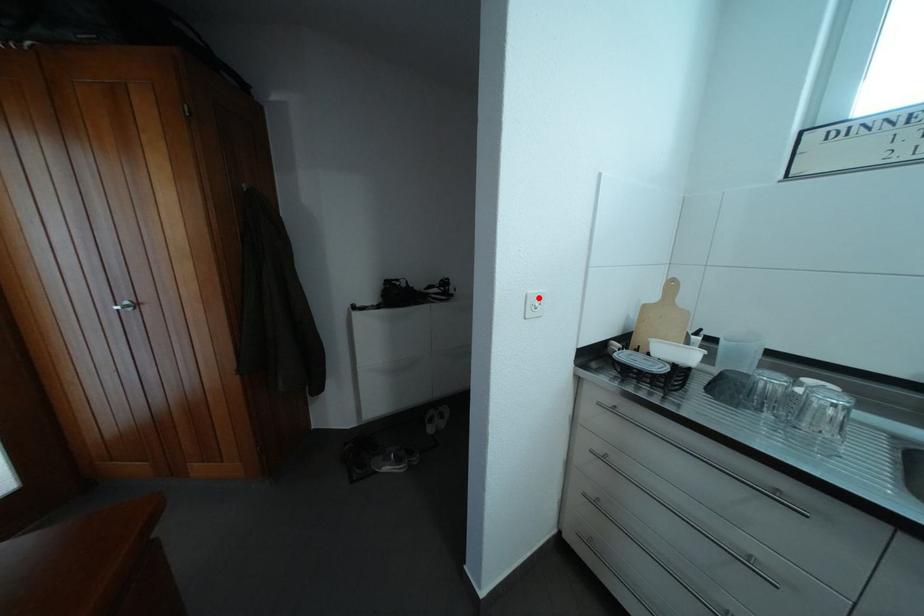
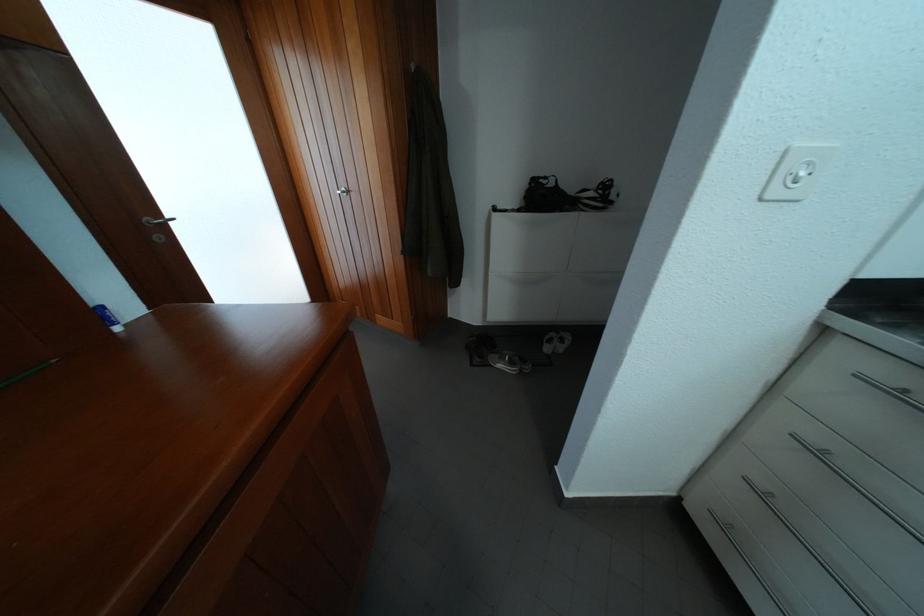
Find the pixel in the second image that matches the highlighted location in the first image.

(806, 150)